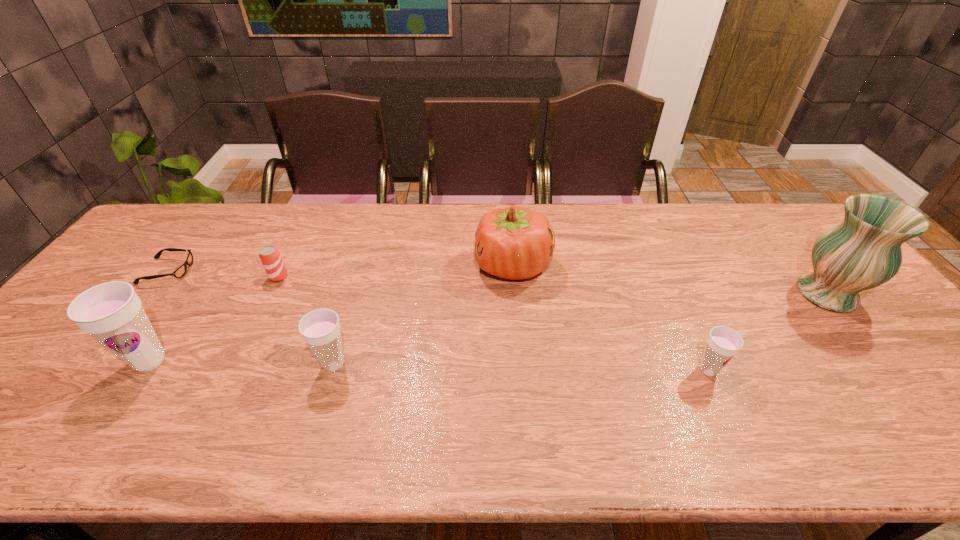
This screenshot has width=960, height=540. I want to click on free spot between the rightmost object and the tallest cup, so click(x=489, y=327).

The height and width of the screenshot is (540, 960). I want to click on vacant space in between the shortest object and the rightmost object, so click(497, 282).

The width and height of the screenshot is (960, 540). What are the coordinates of `unoccupied area between the rightmost object and the second cup from right to left` in the screenshot? It's located at (581, 329).

Identify the location of free space between the pumpkin and the vase. This screenshot has height=540, width=960. coord(670,280).

Where is `free space between the rightmost object and the shortest cup`? Image resolution: width=960 pixels, height=540 pixels. free space between the rightmost object and the shortest cup is located at coordinates (768, 332).

Where is `vacant area that lies between the fifth object from left to right and the fourth tallest object`? Image resolution: width=960 pixels, height=540 pixels. vacant area that lies between the fifth object from left to right and the fourth tallest object is located at coordinates (423, 315).

At what (x,y) coordinates should I click in order to perform the action: click on free space between the shortest object and the pumpkin. Please return your answer as a coordinate pair (x, y). Looking at the image, I should click on (340, 268).

In order to click on object that is the fourth closest to the second tallest cup in this screenshot , I will do `click(179, 272)`.

I want to click on object identified as the closest to the shortest object, so click(112, 313).

Locate which cup ranks second in proximity to the fourth object from left to right. Please provide its 2D coordinates. Your answer should be formatted as a tuple, i.e. [(x, y)], where the tuple contains the x and y coordinates of a point satisfying the conditions above.

[(723, 343)]